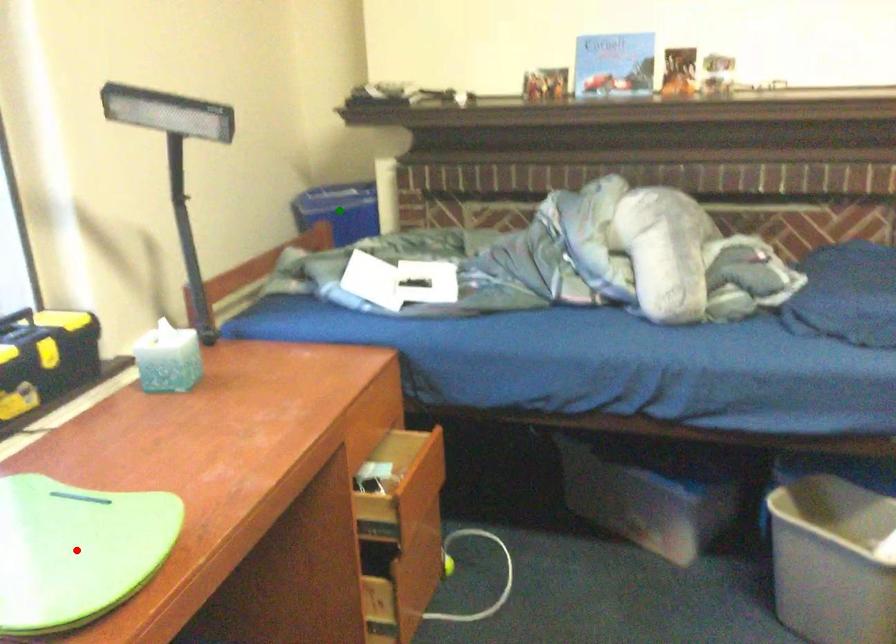
Order these from nearest to farthest:
- yellow point
- green point
- red point

red point, yellow point, green point